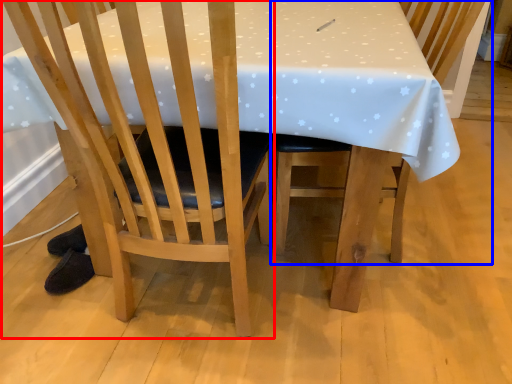
Question: Which of the following is the farthest to the observer, chair (highlighted by a red box) or chair (highlighted by a blue box)?

Choices:
 (A) chair
 (B) chair

Answer: (B)